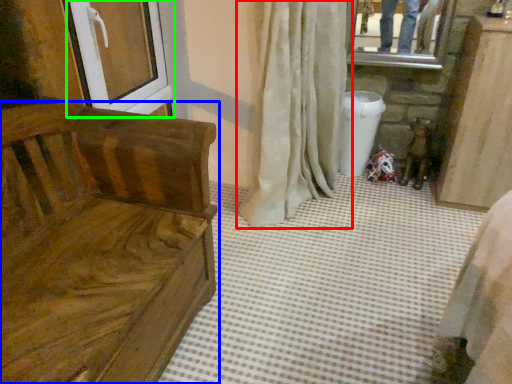
Question: Which object is the farthest from curtain (highlighted by a red box)? Choose among these: furniture (highlighted by a blue box) or screen door (highlighted by a green box).

Choices:
 (A) furniture
 (B) screen door

Answer: (A)